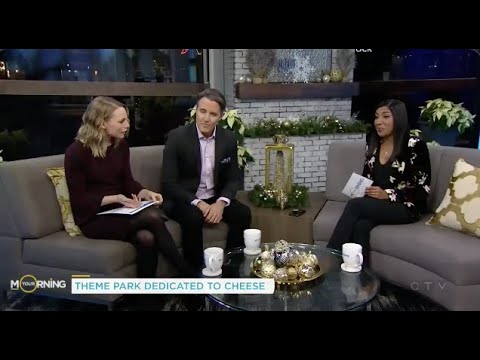
This screenshot has height=360, width=480. Identify the location of saucers. pos(350,270), pos(252,252), pos(210,274).